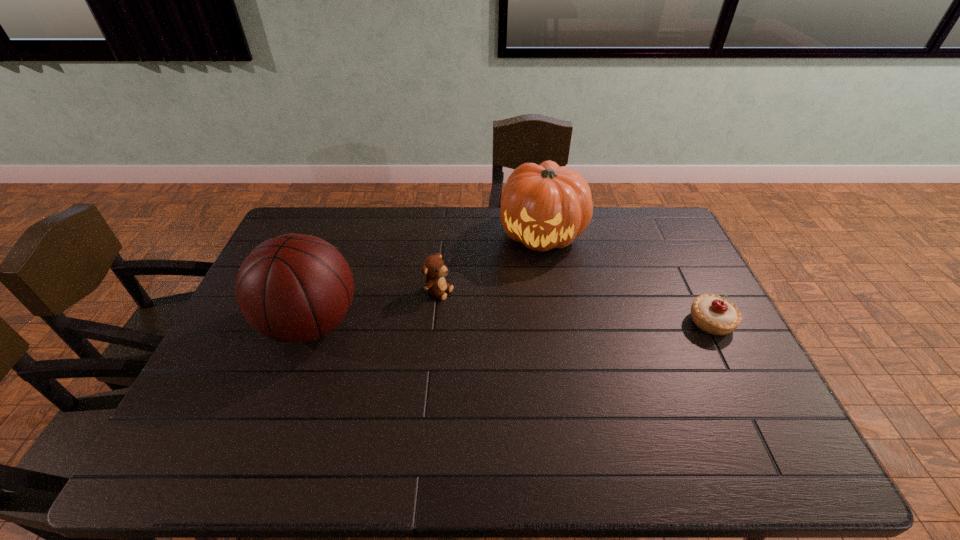
Find the location of a particular element. the leftmost object is located at coordinates (295, 288).

The image size is (960, 540). Find the location of `pastry`. pastry is located at coordinates (715, 315).

I want to click on the rightmost object, so click(x=715, y=315).

Where is `the third object from right to left`? the third object from right to left is located at coordinates (434, 267).

Locate an element on the screen. The image size is (960, 540). the third tallest object is located at coordinates [x=434, y=267].

Find the location of a particular element. Image resolution: width=960 pixels, height=540 pixels. the second object from right to left is located at coordinates (545, 206).

Where is `pumpkin`? The image size is (960, 540). pumpkin is located at coordinates (545, 206).

Locate an element on the screen. The image size is (960, 540). vacant space located on the right of the leftmost object is located at coordinates (430, 324).

This screenshot has height=540, width=960. In order to click on blank area located on the left of the shortest object in this screenshot , I will do `click(555, 322)`.

I want to click on free space located 0.080m on the face of the teddy bear, so click(473, 305).